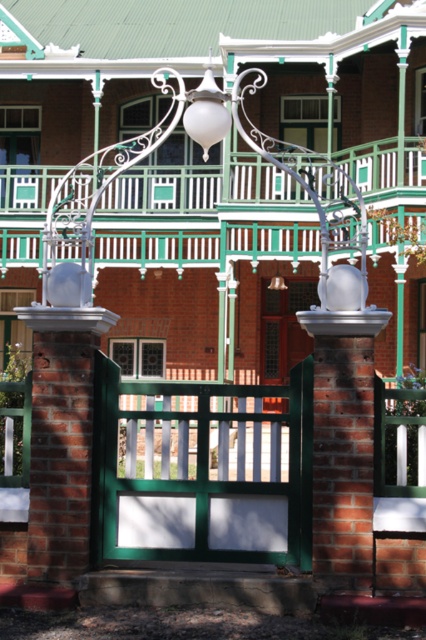
Question: Does green painted wood gate at center have a smaller size compared to white matte lamp at upper center?

Choices:
 (A) no
 (B) yes

Answer: (A)

Question: In this image, where is green painted wood gate at center located relative to matte glass door at center?

Choices:
 (A) above
 (B) below

Answer: (B)

Question: Is matte glass door at center further to the viewer compared to white matte lamp at upper center?

Choices:
 (A) no
 (B) yes

Answer: (B)

Question: Estimate the real-world distances between objects in this image. Which object is closer to the green painted wood gate at center?

Choices:
 (A) matte glass door at center
 (B) white matte lamp at upper center

Answer: (B)

Question: Which object is farther from the camera taking this photo?

Choices:
 (A) matte glass door at center
 (B) green painted wood gate at center

Answer: (A)

Question: Which object is closer to the camera taking this photo?

Choices:
 (A) matte glass door at center
 (B) green painted wood gate at center

Answer: (B)